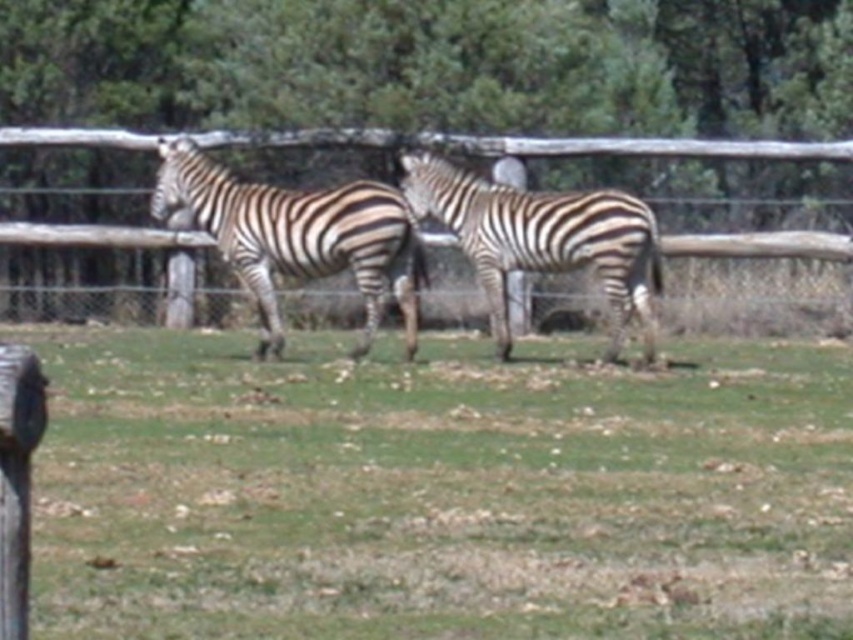
Does black and white striped zebra at left have a lesser width compared to black and white striped zebra at center?

In fact, black and white striped zebra at left might be wider than black and white striped zebra at center.

Is black and white striped zebra at left above black and white striped zebra at center?

Correct, black and white striped zebra at left is located above black and white striped zebra at center.

I want to click on black and white striped zebra at left, so click(299, 236).

Can you confirm if wooden fence at center is positioned below black and white striped zebra at center?

Actually, wooden fence at center is above black and white striped zebra at center.

Does wooden fence at center have a greater height compared to black and white striped zebra at center?

In fact, wooden fence at center may be shorter than black and white striped zebra at center.

Is point (62, 140) closer to viewer compared to point (491, 316)?

No.

The height and width of the screenshot is (640, 853). In order to click on wooden fence at center in this screenshot , I will do [x=532, y=144].

Can you confirm if green grass at center is wider than black and white striped zebra at center?

Indeed, green grass at center has a greater width compared to black and white striped zebra at center.

Does green grass at center have a smaller size compared to black and white striped zebra at center?

Incorrect, green grass at center is not smaller in size than black and white striped zebra at center.

The width and height of the screenshot is (853, 640). What do you see at coordinates (438, 490) in the screenshot? I see `green grass at center` at bounding box center [438, 490].

The image size is (853, 640). In order to click on green grass at center in this screenshot , I will do `click(438, 490)`.